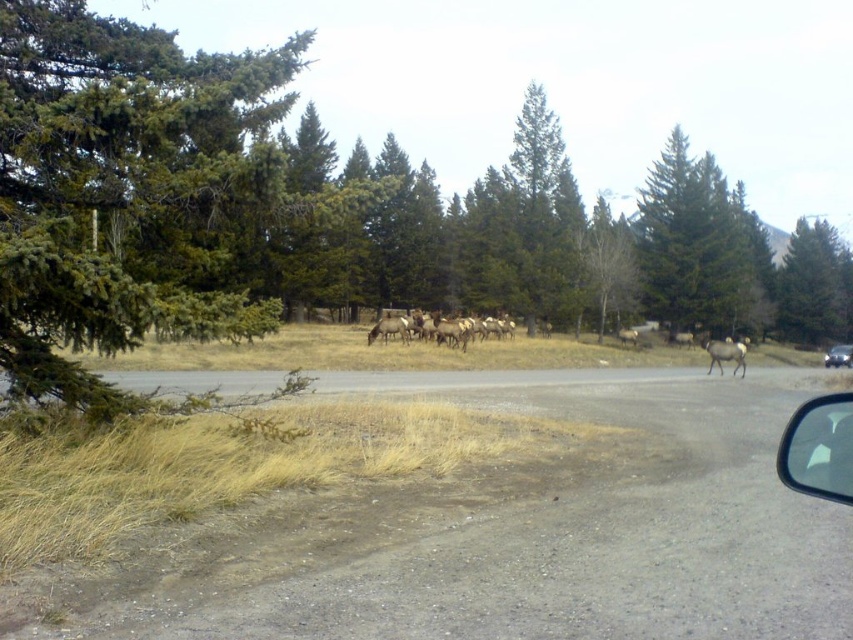
Question: From the image, what is the correct spatial relationship of green textured tree at upper left in relation to green matte tree at upper center?

Choices:
 (A) left
 (B) right

Answer: (A)

Question: Does green matte tree at upper right appear over black glossy car at center?

Choices:
 (A) no
 (B) yes

Answer: (B)

Question: Can you confirm if green matte tree at upper right is positioned to the left of transparent plastic mirror at lower right?

Choices:
 (A) no
 (B) yes

Answer: (A)

Question: Which point is closer to the camera taking this photo?

Choices:
 (A) (714, 177)
 (B) (671, 250)
 (C) (782, 454)
 (D) (821, 224)

Answer: (C)

Question: Which point is farther to the camera?

Choices:
 (A) green matte tree at upper center
 (B) transparent plastic mirror at lower right

Answer: (A)

Question: Which object is the farthest from the black glossy car at center?

Choices:
 (A) transparent plastic mirror at lower right
 (B) green matte tree at upper right

Answer: (A)